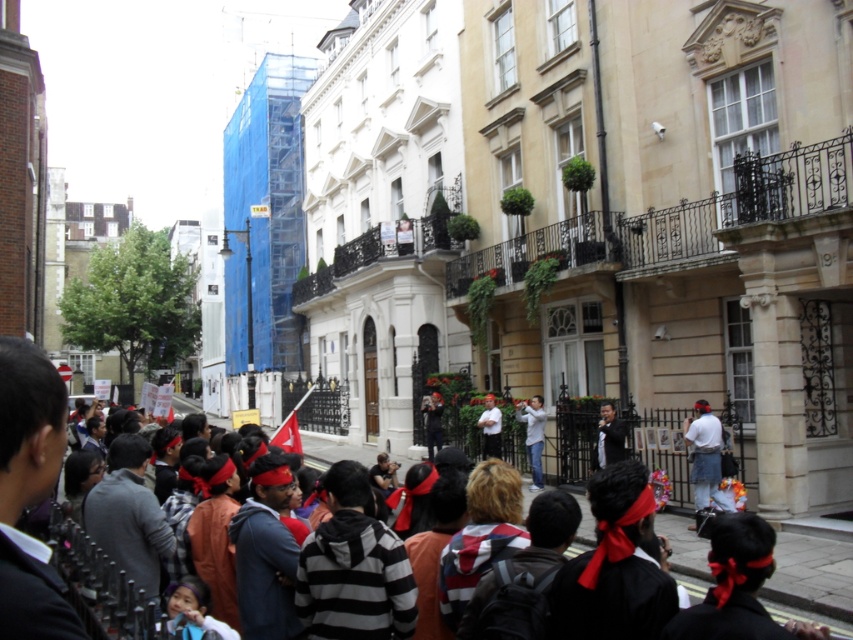
You are standing at the point marked as point [608,436] in the image. What object are you currently standing on?

You are standing on the black leather jacket at center.

You are a photographer trying to capture the crowd in the lively street scene. You notice a person wearing a white shirt at center and a matte black camera at center. From your perspective, which object is positioned to the right?

The white shirt at center is positioned to the right of the matte black camera at center, so the white shirt at center is the object on the right.

You are a photographer standing in the crowd and want to take a photo of the white cotton shirt at center and the white shirt at center. Which one appears shorter in the photo?

The white cotton shirt at center appears shorter compared to the white shirt at center in the photo.